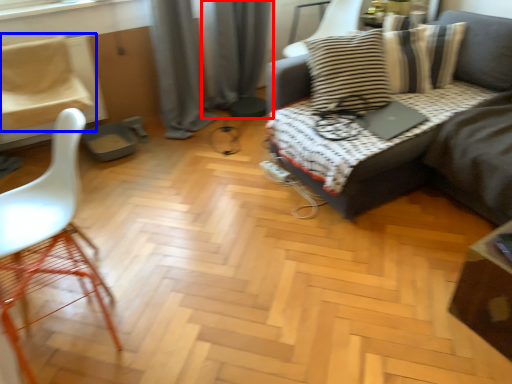
Question: Which object appears closest to the camera in this image, curtain (highlighted by a red box) or chair (highlighted by a blue box)?

Choices:
 (A) curtain
 (B) chair

Answer: (B)